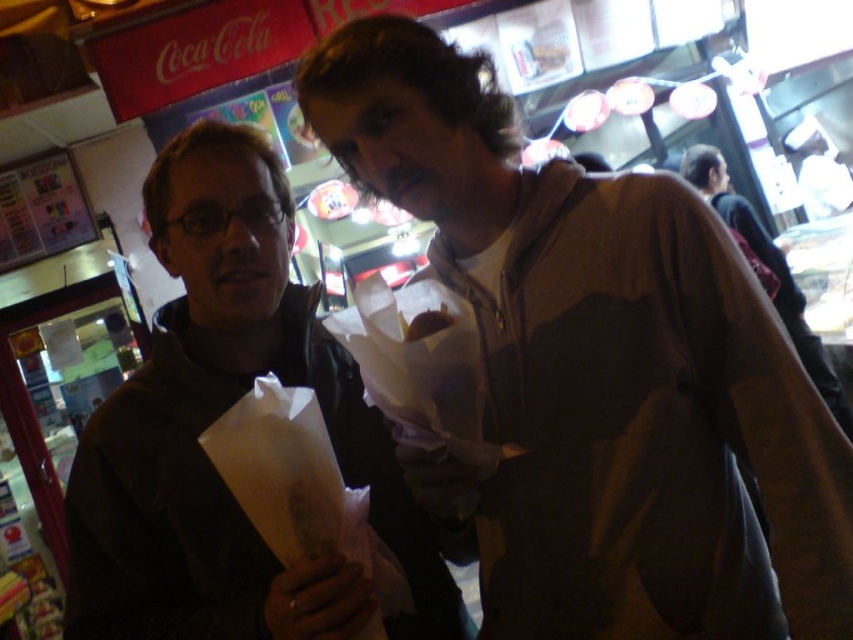
Question: Which point appears farthest from the camera in this image?

Choices:
 (A) (802, 323)
 (B) (167, 458)

Answer: (A)

Question: Which object is closer to the camera taking this photo?

Choices:
 (A) white paper bag at lower left
 (B) dark brown jacket at center
 (C) matte brown jacket at center
 (D) brown paper bag at center

Answer: (C)

Question: Can you confirm if white paper bag at lower left is positioned below brown leather jacket at right?

Choices:
 (A) no
 (B) yes

Answer: (B)

Question: Which object appears farthest from the camera in this image?

Choices:
 (A) brown paper bag at center
 (B) white paper bag at lower left
 (C) dark brown jacket at center

Answer: (A)

Question: Is brown leather jacket at right bigger than brown paper bag at center?

Choices:
 (A) yes
 (B) no

Answer: (A)

Question: Does matte brown jacket at center have a greater width compared to brown leather jacket at right?

Choices:
 (A) no
 (B) yes

Answer: (B)